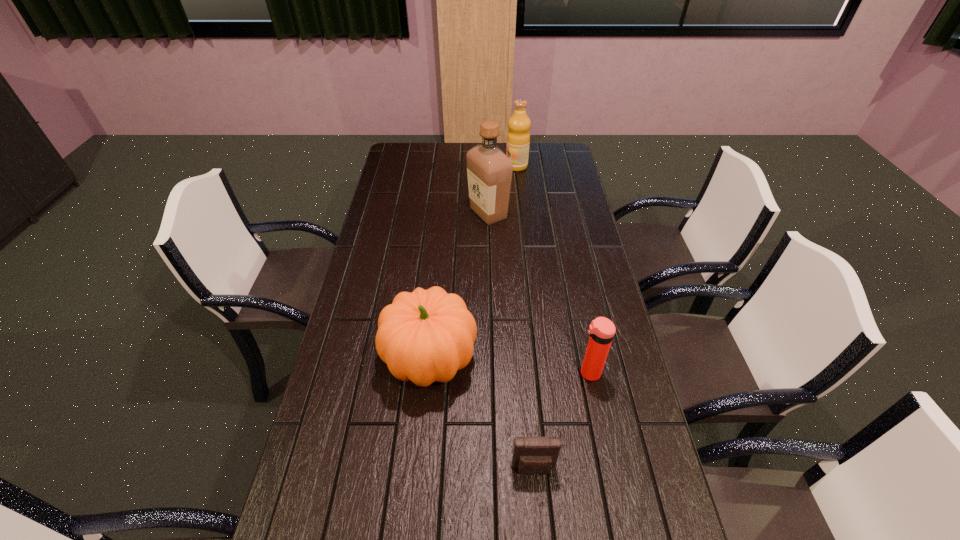
Where is `the second farthest object`? the second farthest object is located at coordinates (489, 170).

Identify the location of the tallest object. (489, 170).

Locate an element on the screen. The height and width of the screenshot is (540, 960). the second tallest object is located at coordinates (518, 137).

This screenshot has height=540, width=960. Find the location of `the farthest object`. the farthest object is located at coordinates (518, 137).

Locate an element on the screen. The image size is (960, 540). pumpkin is located at coordinates (425, 336).

Where is `thermos bottle`? The image size is (960, 540). thermos bottle is located at coordinates (601, 330).

I want to click on the shortest object, so click(532, 455).

Locate an element on the screen. pouch is located at coordinates (532, 455).

Identify the location of blank space located 0.320m on the front-facing side of the tallest object. The width and height of the screenshot is (960, 540). click(x=386, y=213).

This screenshot has height=540, width=960. What are the coordinates of `vacant space located on the front-facing side of the tallest object` in the screenshot? It's located at (449, 213).